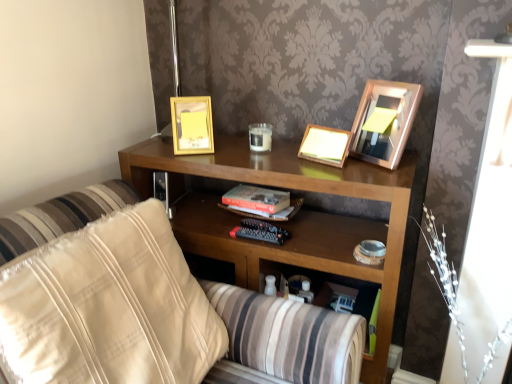
Question: Is wooden shelf at center taller than wooden picture frame at center, which is counted as the 2th picture frame, starting from the left?

Choices:
 (A) yes
 (B) no

Answer: (A)

Question: Considering the relative sizes of wooden shelf at center and wooden picture frame at center, which is counted as the 2th picture frame, starting from the left, in the image provided, is wooden shelf at center bigger than wooden picture frame at center, which is counted as the 2th picture frame, starting from the left,?

Choices:
 (A) no
 (B) yes

Answer: (B)

Question: Is wooden shelf at center shorter than wooden picture frame at center, the second picture frame viewed from the right?

Choices:
 (A) no
 (B) yes

Answer: (A)

Question: Could you tell me if wooden shelf at center is facing wooden picture frame at center, which is counted as the 2th picture frame, starting from the left?

Choices:
 (A) no
 (B) yes

Answer: (A)

Question: Is wooden shelf at center positioned with its back to wooden picture frame at center, which is counted as the 2th picture frame, starting from the left?

Choices:
 (A) yes
 (B) no

Answer: (B)

Question: Considering the positions of beige fabric pillow at left and wooden picture frame at center, the second picture frame viewed from the right, in the image, is beige fabric pillow at left bigger or smaller than wooden picture frame at center, the second picture frame viewed from the right,?

Choices:
 (A) small
 (B) big

Answer: (B)

Question: From the image's perspective, is beige fabric pillow at left located above or below wooden picture frame at center, which is counted as the 2th picture frame, starting from the left?

Choices:
 (A) above
 (B) below

Answer: (B)

Question: From a real-world perspective, relative to wooden picture frame at center, the second picture frame viewed from the right, is beige fabric pillow at left vertically above or below?

Choices:
 (A) above
 (B) below

Answer: (B)

Question: Considering their positions, is beige fabric pillow at left located in front of or behind wooden picture frame at center, which is counted as the 2th picture frame, starting from the left?

Choices:
 (A) front
 (B) behind

Answer: (A)

Question: Considering the positions of gold metallic picture frame at upper center, which ranks as the 1th picture frame in left-to-right order, and beige fabric pillow at left in the image, is gold metallic picture frame at upper center, which ranks as the 1th picture frame in left-to-right order, wider or thinner than beige fabric pillow at left?

Choices:
 (A) wide
 (B) thin

Answer: (B)

Question: Looking at the image, does gold metallic picture frame at upper center, which ranks as the 1th picture frame in left-to-right order, seem bigger or smaller compared to beige fabric pillow at left?

Choices:
 (A) big
 (B) small

Answer: (B)

Question: In the image, is gold metallic picture frame at upper center, acting as the third picture frame starting from the right, positioned in front of or behind beige fabric pillow at left?

Choices:
 (A) front
 (B) behind

Answer: (B)

Question: In the image, is gold metallic picture frame at upper center, which ranks as the 1th picture frame in left-to-right order, on the left side or the right side of beige fabric pillow at left?

Choices:
 (A) right
 (B) left

Answer: (A)

Question: Is wooden shelf at center spatially inside beige fabric pillow at left, or outside of it?

Choices:
 (A) inside
 (B) outside

Answer: (B)

Question: Is wooden shelf at center to the left or to the right of beige fabric pillow at left in the image?

Choices:
 (A) right
 (B) left

Answer: (A)